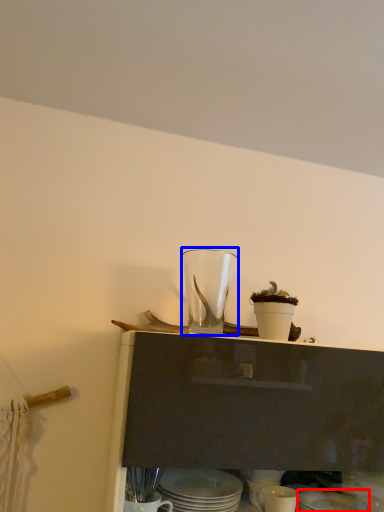
Question: Which point is closer to the camera, tableware (highlighted by a red box) or tableware (highlighted by a blue box)?

Choices:
 (A) tableware
 (B) tableware

Answer: (A)